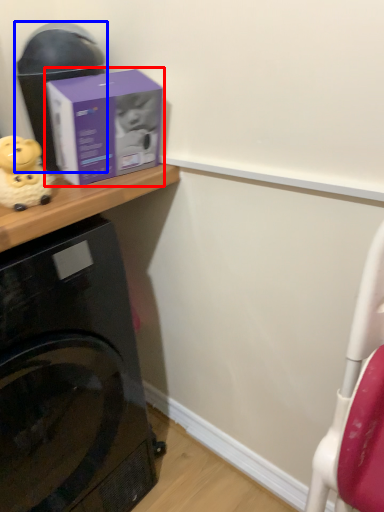
Question: Which of the following is the closest to the observer, box (highlighted by a red box) or appliance (highlighted by a blue box)?

Choices:
 (A) box
 (B) appliance

Answer: (A)